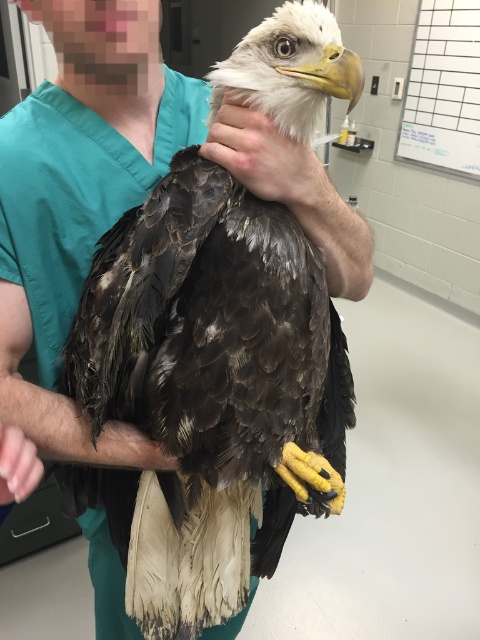
Is brown feathered eagle at center to the left of matte green scrub at upper center from the viewer's perspective?

Indeed, brown feathered eagle at center is positioned on the left side of matte green scrub at upper center.

Does brown feathered eagle at center appear on the right side of matte green scrub at upper center?

Incorrect, brown feathered eagle at center is not on the right side of matte green scrub at upper center.

You are a GUI agent. You are given a task and a screenshot of the screen. Output one action in this format:
    pyautogui.click(x=<x>, y=<y>)
    Task: Click on the brown feathered eagle at center
    The width and height of the screenshot is (480, 640).
    Given the screenshot: What is the action you would take?
    pyautogui.click(x=205, y=390)

Based on the photo, is matte green scrub at upper center to the right of pink flesh at lower left from the viewer's perspective?

Yes, matte green scrub at upper center is to the right of pink flesh at lower left.

Is point (215, 140) more distant than point (27, 458)?

Yes, it is.

Find the location of a particular element. matte green scrub at upper center is located at coordinates coord(295,189).

Can you confirm if brown feathered eagle at center is positioned to the left of pink flesh at lower left?

Incorrect, brown feathered eagle at center is not on the left side of pink flesh at lower left.

Does brown feathered eagle at center have a greater width compared to pink flesh at lower left?

Correct, the width of brown feathered eagle at center exceeds that of pink flesh at lower left.

Does point (195, 209) come closer to viewer compared to point (20, 460)?

No.

You are a GUI agent. You are given a task and a screenshot of the screen. Output one action in this format:
    pyautogui.click(x=<x>, y=<y>)
    Task: Click on the brown feathered eagle at center
    This screenshot has height=640, width=480.
    Given the screenshot: What is the action you would take?
    pyautogui.click(x=205, y=390)